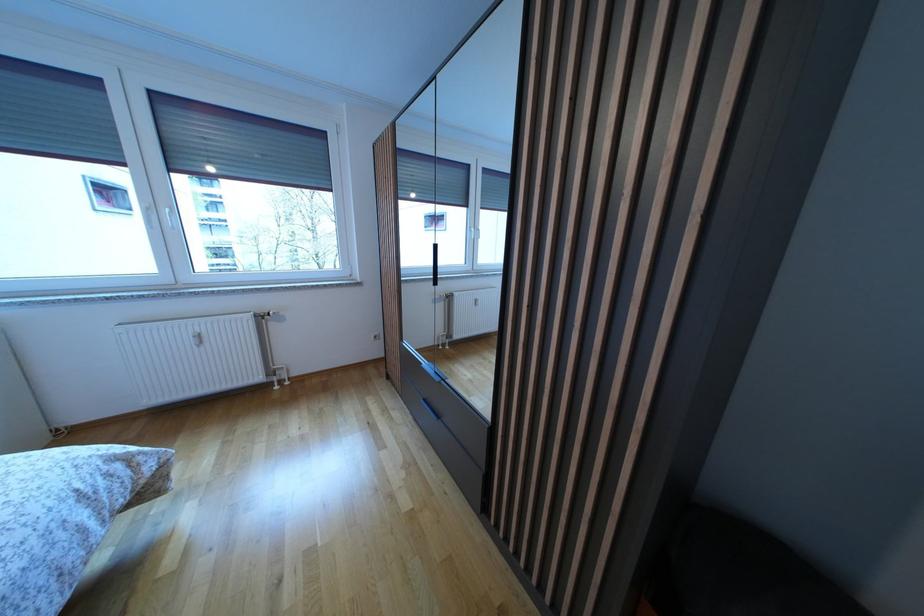
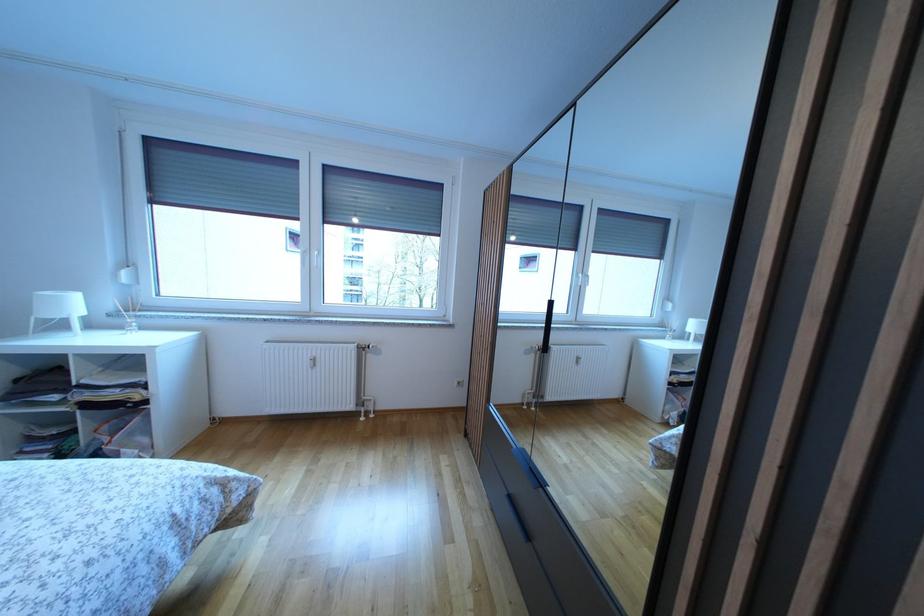
The images are taken continuously from a first-person perspective. In which direction are you moving?

The movement direction of the cameraman is left, forward.